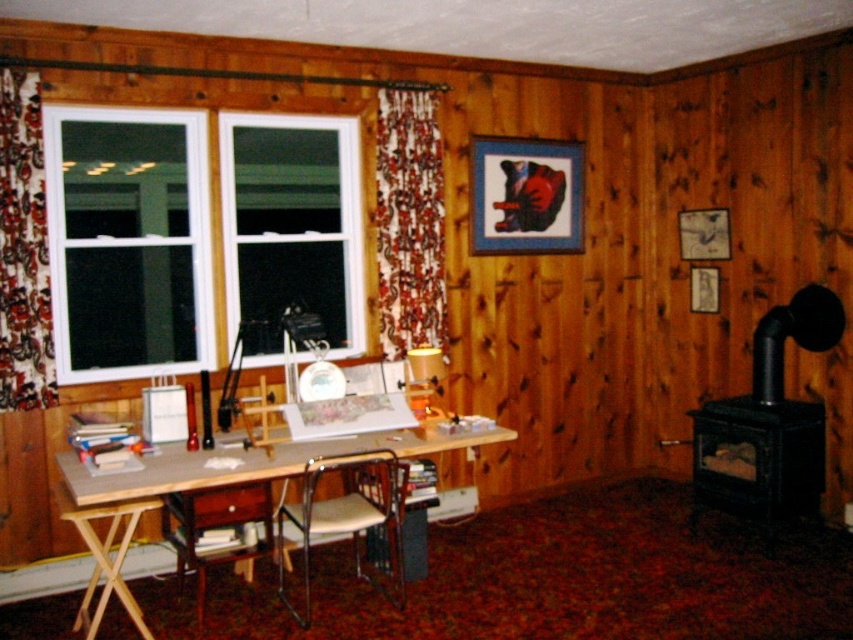
You are organizing a small event and need to move the floral fabric curtain at left to the right side of the light brown wooden table at lower left. Is this possible without moving the table?

The light brown wooden table at lower left is currently to the right of the floral fabric curtain at left. Moving the curtain to the right side of the table would require moving it past the table, which might not be possible without adjusting the table position first.

You are standing in the room and want to locate the metallic silver picture frame at upper right. According to the coordinates given, where should you look relative to the center of the room?

The metallic silver picture frame at upper right is located at coordinates point 0.367 on the x axis and 0.826 on the y axis, so you should look to the right and slightly above the center of the room.